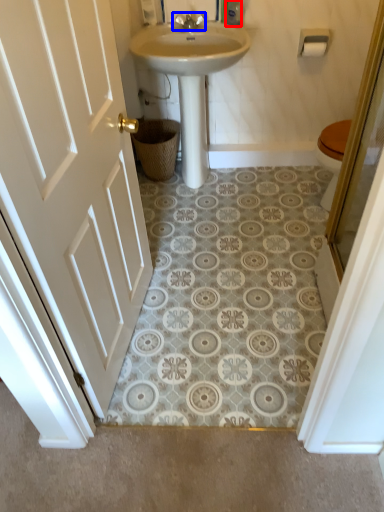
Question: Which point is further to the camera, toiletry (highlighted by a red box) or tap (highlighted by a blue box)?

Choices:
 (A) toiletry
 (B) tap

Answer: (B)